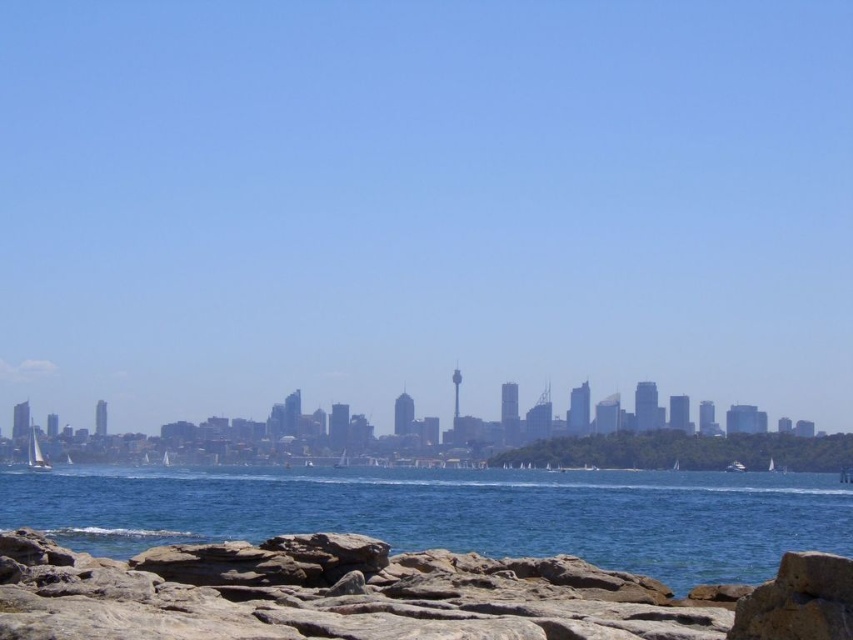
Consider the image. You are standing on the rocky shoreline and want to locate two specific points in the scene. The first point is at coordinate point(300, 508) and the second is at point(30, 445). Which point is closer to you?

Point(300, 508) is closer to the viewer than point(30, 445).

You are a photographer planning to capture the blue water at lower center and the white sailboat at lower left in a single frame. Which of these two elements will occupy more space in your photo?

The blue water at lower center occupies more space in the photo because it is bigger than the white sailboat at lower left according to the description.